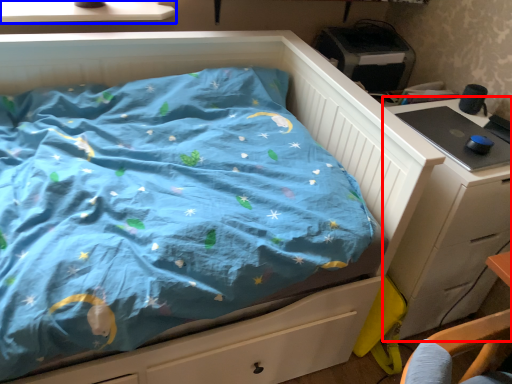
Question: Which point is closer to the camera, chest of drawers (highlighted by a red box) or window sill (highlighted by a blue box)?

Choices:
 (A) chest of drawers
 (B) window sill

Answer: (A)